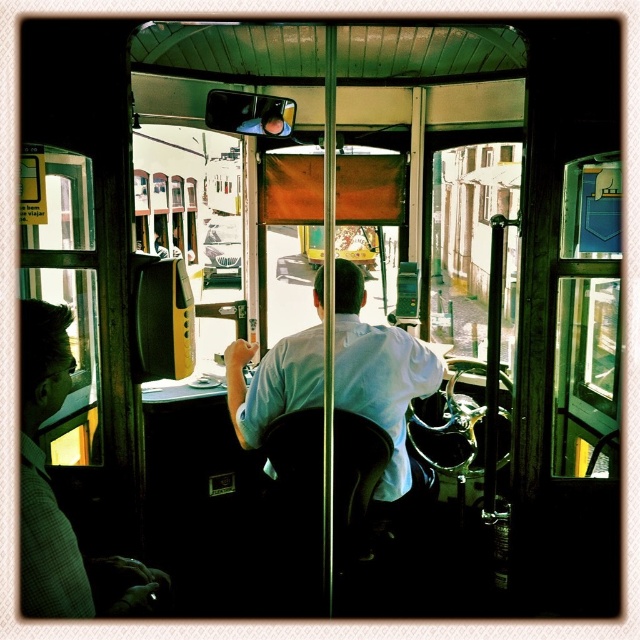
Is the position of white shirt at center more distant than that of matte black coach at left?

That is True.

Does white shirt at center appear on the left side of matte black coach at left?

In fact, white shirt at center is to the right of matte black coach at left.

Is point (385, 396) in front of point (42, 332)?

No, it is behind (42, 332).

Find the location of `white shirt at center`. white shirt at center is located at coordinates coord(380,376).